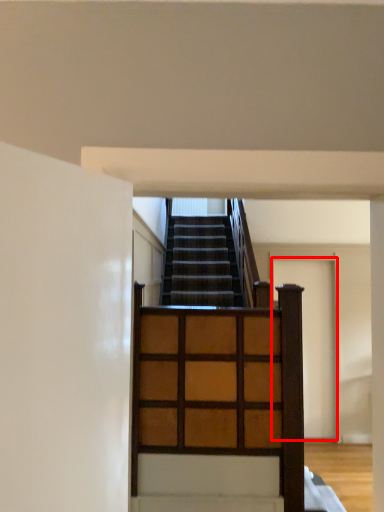
Question: Where is door (annotated by the red box) located in relation to dresser in the image?

Choices:
 (A) right
 (B) left

Answer: (A)